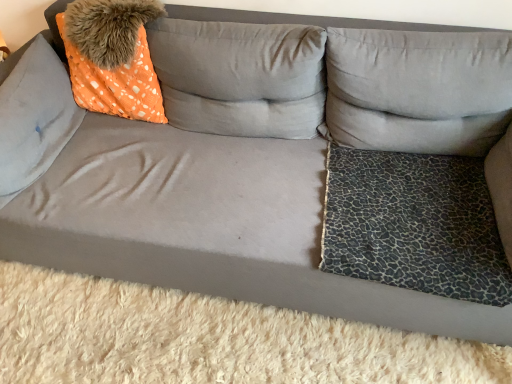
Question: Is suede orange pillow at left, acting as the 1th pillow starting from the left, at the right side of orange dotted fabric pillow at upper left, acting as the second pillow starting from the left?

Choices:
 (A) yes
 (B) no

Answer: (B)

Question: Is suede orange pillow at left, the third pillow positioned from the right, taller than orange dotted fabric pillow at upper left, which is the 2th pillow in right-to-left order?

Choices:
 (A) yes
 (B) no

Answer: (B)

Question: Is suede orange pillow at left, acting as the 1th pillow starting from the left, shorter than orange dotted fabric pillow at upper left, which is the 2th pillow in right-to-left order?

Choices:
 (A) no
 (B) yes

Answer: (B)

Question: From a real-world perspective, is suede orange pillow at left, the third pillow positioned from the right, under orange dotted fabric pillow at upper left, which is the 2th pillow in right-to-left order?

Choices:
 (A) yes
 (B) no

Answer: (A)

Question: Is orange dotted fabric pillow at upper left, which is the 2th pillow in right-to-left order, surrounded by suede orange pillow at left, the third pillow positioned from the right?

Choices:
 (A) yes
 (B) no

Answer: (B)

Question: Is leopard print fabric dog bed at lower right bigger or smaller than leopard print fabric pillow at right, the 1th pillow when ordered from right to left?

Choices:
 (A) big
 (B) small

Answer: (B)

Question: Which is correct: leopard print fabric dog bed at lower right is inside leopard print fabric pillow at right, the 1th pillow when ordered from right to left, or outside of it?

Choices:
 (A) inside
 (B) outside

Answer: (B)

Question: In terms of width, does leopard print fabric dog bed at lower right look wider or thinner when compared to leopard print fabric pillow at right, the 1th pillow when ordered from right to left?

Choices:
 (A) wide
 (B) thin

Answer: (A)

Question: Considering their positions, is leopard print fabric dog bed at lower right located in front of or behind leopard print fabric pillow at right, which is the third pillow from left to right?

Choices:
 (A) behind
 (B) front

Answer: (B)

Question: From a real-world perspective, relative to suede orange pillow at left, the third pillow positioned from the right, is orange dotted fabric pillow at upper left, which is the 2th pillow in right-to-left order, vertically above or below?

Choices:
 (A) below
 (B) above

Answer: (B)

Question: Would you say orange dotted fabric pillow at upper left, which is the 2th pillow in right-to-left order, is to the left or to the right of suede orange pillow at left, acting as the 1th pillow starting from the left, in the picture?

Choices:
 (A) right
 (B) left

Answer: (A)

Question: Is orange dotted fabric pillow at upper left, which is the 2th pillow in right-to-left order, wider or thinner than suede orange pillow at left, the third pillow positioned from the right?

Choices:
 (A) thin
 (B) wide

Answer: (B)

Question: Is point (197, 112) positioned closer to the camera than point (27, 79)?

Choices:
 (A) farther
 (B) closer

Answer: (A)

Question: In terms of size, does orange dotted fabric at upper left appear bigger or smaller than leopard print fabric dog bed at lower right?

Choices:
 (A) big
 (B) small

Answer: (A)

Question: Is orange dotted fabric at upper left to the left or to the right of leopard print fabric dog bed at lower right in the image?

Choices:
 (A) right
 (B) left

Answer: (B)